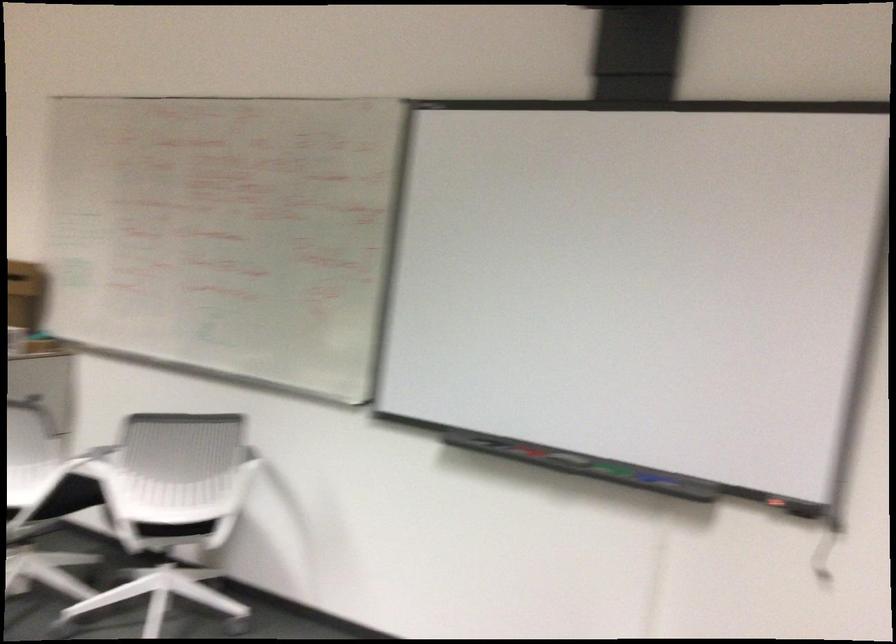
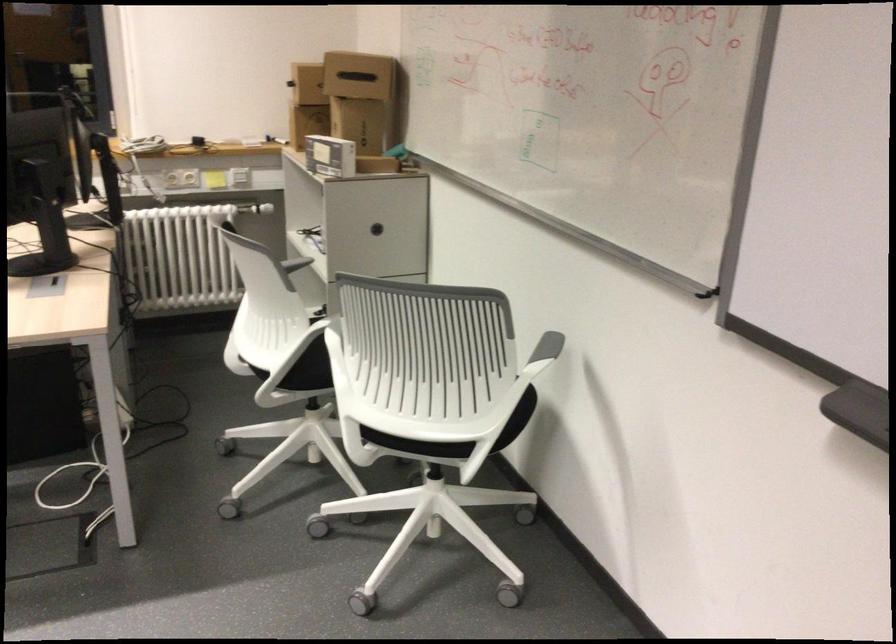
In the second image, find the point that corresponds to point 237,457 in the first image.

(547, 346)